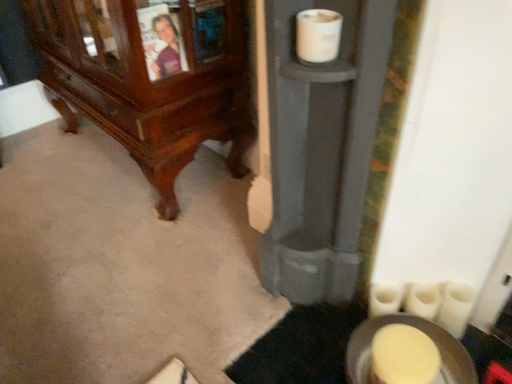
What do you see at coordinates (149, 79) in the screenshot? I see `polished wood cabinet at lower left` at bounding box center [149, 79].

Find the location of a particular element. The height and width of the screenshot is (384, 512). white matte toilet paper at lower right, the 2th toilet paper positioned from the bottom is located at coordinates (384, 300).

The height and width of the screenshot is (384, 512). In order to click on polished wood cabinet at lower left in this screenshot , I will do `click(149, 79)`.

In the scene shown: Which of these two, polished wood cabinet at lower left or white matte toilet paper at lower right, the second toilet paper viewed from the back, stands shorter?

white matte toilet paper at lower right, the second toilet paper viewed from the back, is shorter.

Which point is more distant from viewer, [228,101] or [460,309]?

The point [228,101] is behind.

You are a GUI agent. You are given a task and a screenshot of the screen. Output one action in this format:
    pyautogui.click(x=<x>, y=<y>)
    Task: Click on the 1st toilet paper behind when counting from the polished wood cabinet at lower left
    The width and height of the screenshot is (512, 384).
    Given the screenshot: What is the action you would take?
    pyautogui.click(x=455, y=307)

Does point (310, 38) come closer to viewer compared to point (210, 125)?

Yes, it is.

Based on the photo, from the image's perspective, which object appears higher, white matte toilet paper at upper center, the third toilet paper when ordered from bottom to top, or polished wood cabinet at lower left?

From the image's view, polished wood cabinet at lower left is above.

From a real-world perspective, is white matte toilet paper at upper center, acting as the 3th toilet paper starting from the back, on top of polished wood cabinet at lower left?

Correct, in the physical world, white matte toilet paper at upper center, acting as the 3th toilet paper starting from the back, is higher than polished wood cabinet at lower left.

Considering the relative sizes of polished wood cabinet at lower left and white matte toilet paper at lower right, the 1th toilet paper from the back, in the image provided, is polished wood cabinet at lower left taller than white matte toilet paper at lower right, the 1th toilet paper from the back,?

Correct, polished wood cabinet at lower left is much taller as white matte toilet paper at lower right, the 1th toilet paper from the back.

Does polished wood cabinet at lower left contain white matte toilet paper at lower right, which is counted as the 2th toilet paper, starting from the top?

No, white matte toilet paper at lower right, which is counted as the 2th toilet paper, starting from the top, is not inside polished wood cabinet at lower left.

From a real-world perspective, is polished wood cabinet at lower left positioned above or below white matte toilet paper at lower right, the second toilet paper from the right?

polished wood cabinet at lower left is situated higher than white matte toilet paper at lower right, the second toilet paper from the right, in the real world.

Is point (181, 123) positioned before point (375, 287)?

No, (181, 123) is behind (375, 287).

From their relative heights in the image, would you say white matte toilet paper at upper center, the third toilet paper when ordered from bottom to top, is taller or shorter than white matte toilet paper at lower right, which is counted as the 2th toilet paper, starting from the top?

In the image, white matte toilet paper at upper center, the third toilet paper when ordered from bottom to top, appears to be shorter than white matte toilet paper at lower right, which is counted as the 2th toilet paper, starting from the top.

Which is correct: white matte toilet paper at upper center, which ranks as the 1th toilet paper in top-to-bottom order, is inside white matte toilet paper at lower right, the 1th toilet paper from the back, or outside of it?

The correct answer is: outside.

Is white matte toilet paper at upper center, the 1th toilet paper viewed from the left, closer to camera compared to white matte toilet paper at lower right, the second toilet paper from the right?

Yes.

Which is more to the left, white matte toilet paper at upper center, the 1th toilet paper viewed from the left, or white matte toilet paper at lower right, the 2th toilet paper in the left-to-right sequence?

white matte toilet paper at upper center, the 1th toilet paper viewed from the left, is more to the left.

In terms of width, does white matte toilet paper at upper center, acting as the 3th toilet paper starting from the back, look wider or thinner when compared to white matte toilet paper at lower right, the first toilet paper positioned from the bottom?

In the image, white matte toilet paper at upper center, acting as the 3th toilet paper starting from the back, appears to be more narrow than white matte toilet paper at lower right, the first toilet paper positioned from the bottom.

Between white matte toilet paper at upper center, the third toilet paper when ordered from bottom to top, and white matte toilet paper at lower right, the second toilet paper viewed from the back, which one is positioned in front?

white matte toilet paper at upper center, the third toilet paper when ordered from bottom to top, is more forward.

Does white matte toilet paper at upper center, which ranks as the 1th toilet paper in top-to-bottom order, have a lesser height compared to white matte toilet paper at lower right, the second toilet paper viewed from the back?

Yes.

Looking at this image, considering the positions of objects white matte toilet paper at lower right, the 1th toilet paper from the back, and polished wood cabinet at lower left in the image provided, who is in front, white matte toilet paper at lower right, the 1th toilet paper from the back, or polished wood cabinet at lower left?

polished wood cabinet at lower left is more forward.

From the image's perspective, does white matte toilet paper at lower right, the 1th toilet paper from the back, appear higher than polished wood cabinet at lower left?

No, from the image's perspective, white matte toilet paper at lower right, the 1th toilet paper from the back, is not above polished wood cabinet at lower left.

Do you think white matte toilet paper at lower right, the 2th toilet paper in the left-to-right sequence, is within polished wood cabinet at lower left, or outside of it?

white matte toilet paper at lower right, the 2th toilet paper in the left-to-right sequence, lies outside polished wood cabinet at lower left.

At what (x,y) coordinates should I click in order to perform the action: click on furniture behind the white matte toilet paper at upper center, acting as the 3th toilet paper starting from the back. Please return your answer as a coordinate pair (x, y). The width and height of the screenshot is (512, 384). Looking at the image, I should click on (149, 79).

Could you tell me if polished wood cabinet at lower left is facing white matte toilet paper at upper center, acting as the 3th toilet paper starting from the back?

No, polished wood cabinet at lower left is not aimed at white matte toilet paper at upper center, acting as the 3th toilet paper starting from the back.

Visually, is polished wood cabinet at lower left positioned to the left or to the right of white matte toilet paper at upper center, the third toilet paper when ordered from bottom to top?

From the image, it's evident that polished wood cabinet at lower left is to the left of white matte toilet paper at upper center, the third toilet paper when ordered from bottom to top.

Considering the relative sizes of polished wood cabinet at lower left and white matte toilet paper at upper center, acting as the 1th toilet paper starting from the front, in the image provided, is polished wood cabinet at lower left bigger than white matte toilet paper at upper center, acting as the 1th toilet paper starting from the front,?

Yes.

Where is `the 1st toilet paper positioned below the polished wood cabinet at lower left (from a real-world perspective)`? the 1st toilet paper positioned below the polished wood cabinet at lower left (from a real-world perspective) is located at coordinates tap(455, 307).

You are a GUI agent. You are given a task and a screenshot of the screen. Output one action in this format:
    pyautogui.click(x=<x>, y=<y>)
    Task: Click on the furniture to the left of white matte toilet paper at upper center, acting as the 3th toilet paper starting from the back
    
    Given the screenshot: What is the action you would take?
    pyautogui.click(x=149, y=79)

Estimate the real-world distances between objects in this image. Which object is closer to white matte toilet paper at upper center, which is the third toilet paper in right-to-left order, white matte toilet paper at lower right, which is counted as the 2th toilet paper, starting from the top, or white matte toilet paper at lower right, which appears as the 1th toilet paper when viewed from the right?

The object closer to white matte toilet paper at upper center, which is the third toilet paper in right-to-left order, is white matte toilet paper at lower right, which is counted as the 2th toilet paper, starting from the top.

When comparing their distances from polished wood cabinet at lower left, does white matte toilet paper at lower right, acting as the 3th toilet paper starting from the front, or white matte toilet paper at lower right, marked as the 3th toilet paper in a top-to-bottom arrangement, seem further?

The object further to polished wood cabinet at lower left is white matte toilet paper at lower right, marked as the 3th toilet paper in a top-to-bottom arrangement.

Which object lies further to the anchor point white matte toilet paper at lower right, the 3th toilet paper when ordered from left to right, white matte toilet paper at upper center, the 1th toilet paper viewed from the left, or polished wood cabinet at lower left?

polished wood cabinet at lower left lies further to white matte toilet paper at lower right, the 3th toilet paper when ordered from left to right, than the other object.

From the image, which object appears to be farther from white matte toilet paper at upper center, acting as the 3th toilet paper starting from the back, white matte toilet paper at lower right, the second toilet paper when ordered from front to back, or polished wood cabinet at lower left?

polished wood cabinet at lower left lies further to white matte toilet paper at upper center, acting as the 3th toilet paper starting from the back, than the other object.

Looking at the image, which one is located closer to white matte toilet paper at lower right, which is counted as the 2th toilet paper, starting from the top, white matte toilet paper at upper center, which is the third toilet paper in right-to-left order, or white matte toilet paper at lower right, marked as the 3th toilet paper in a top-to-bottom arrangement?

white matte toilet paper at lower right, marked as the 3th toilet paper in a top-to-bottom arrangement, lies closer to white matte toilet paper at lower right, which is counted as the 2th toilet paper, starting from the top, than the other object.

Estimate the real-world distances between objects in this image. Which object is closer to polished wood cabinet at lower left, white matte toilet paper at upper center, acting as the 1th toilet paper starting from the front, or white matte toilet paper at lower right, which appears as the 1th toilet paper when viewed from the right?

Among the two, white matte toilet paper at upper center, acting as the 1th toilet paper starting from the front, is located nearer to polished wood cabinet at lower left.

From the image, which object appears to be farther from white matte toilet paper at lower right, the 2th toilet paper positioned from the bottom, polished wood cabinet at lower left or white matte toilet paper at upper center, which ranks as the 1th toilet paper in top-to-bottom order?

polished wood cabinet at lower left is positioned further to the anchor white matte toilet paper at lower right, the 2th toilet paper positioned from the bottom.

Considering their positions, is white matte toilet paper at upper center, acting as the 3th toilet paper starting from the back, positioned closer to polished wood cabinet at lower left than white matte toilet paper at lower right, the second toilet paper from the right?

Based on the image, white matte toilet paper at upper center, acting as the 3th toilet paper starting from the back, appears to be nearer to polished wood cabinet at lower left.

Locate an element on the screen. toilet paper that lies between white matte toilet paper at upper center, which is the third toilet paper in right-to-left order, and white matte toilet paper at lower right, the 3th toilet paper when ordered from left to right, from top to bottom is located at coordinates (384, 300).

This screenshot has width=512, height=384. I want to click on toilet paper located between polished wood cabinet at lower left and white matte toilet paper at lower right, acting as the 3th toilet paper starting from the front, in the left-right direction, so click(x=318, y=35).